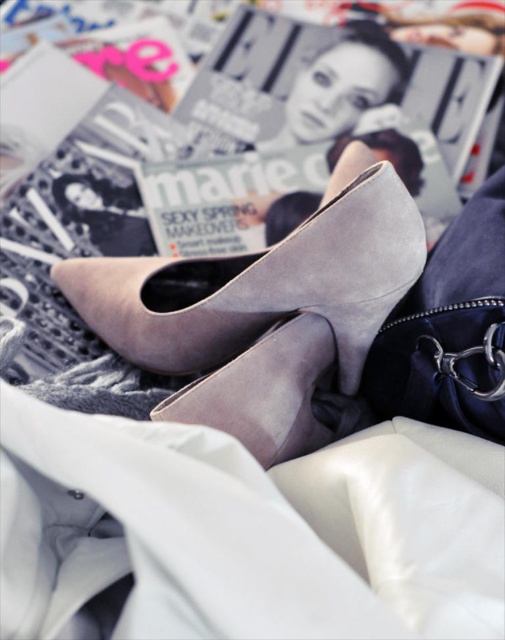
Question: Is suede gray shoe at center positioned behind suede-like beige shoe at upper center?

Choices:
 (A) yes
 (B) no

Answer: (B)

Question: Which point is closer to the camera taking this photo?

Choices:
 (A) (284, 113)
 (B) (165, 292)
 (C) (336, 378)

Answer: (C)

Question: Considering the real-world distances, which object is farthest from the suede-like beige shoe at upper center?

Choices:
 (A) suede high-heeled shoe at center
 (B) suede gray shoe at center

Answer: (B)

Question: Does suede gray shoe at center have a larger size compared to suede-like beige shoe at upper center?

Choices:
 (A) yes
 (B) no

Answer: (B)

Question: Which of the following is the farthest from the observer?

Choices:
 (A) suede gray shoe at center
 (B) suede-like beige shoe at upper center
 (C) suede high-heeled shoe at center

Answer: (B)

Question: Is suede gray shoe at center to the right of suede-like beige shoe at upper center from the viewer's perspective?

Choices:
 (A) no
 (B) yes

Answer: (A)